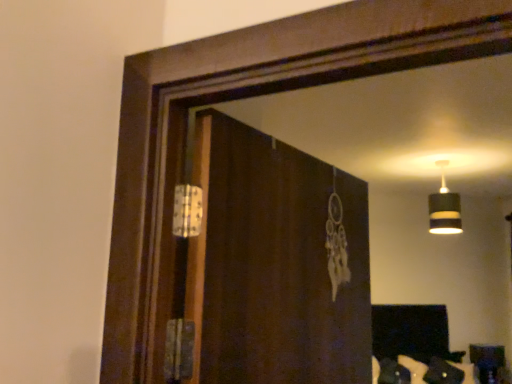
Question: Would you consider black striped lampshade at upper right to be distant from brown wooden screen door at center?

Choices:
 (A) yes
 (B) no

Answer: (A)

Question: Does black striped lampshade at upper right lie behind brown wooden screen door at center?

Choices:
 (A) no
 (B) yes

Answer: (B)

Question: From a real-world perspective, is black striped lampshade at upper right positioned over brown wooden screen door at center based on gravity?

Choices:
 (A) no
 (B) yes

Answer: (B)

Question: From a real-world perspective, is black striped lampshade at upper right under brown wooden screen door at center?

Choices:
 (A) no
 (B) yes

Answer: (A)

Question: Does black striped lampshade at upper right touch brown wooden screen door at center?

Choices:
 (A) no
 (B) yes

Answer: (A)

Question: Is brown wooden screen door at center surrounded by black striped lampshade at upper right?

Choices:
 (A) no
 (B) yes

Answer: (A)

Question: Is wooden table at lower right closer to the viewer compared to brown wooden screen door at center?

Choices:
 (A) no
 (B) yes

Answer: (A)

Question: Does wooden table at lower right have a greater height compared to brown wooden screen door at center?

Choices:
 (A) yes
 (B) no

Answer: (B)

Question: Can you confirm if wooden table at lower right is shorter than brown wooden screen door at center?

Choices:
 (A) no
 (B) yes

Answer: (B)

Question: Is wooden table at lower right looking in the opposite direction of brown wooden screen door at center?

Choices:
 (A) yes
 (B) no

Answer: (B)

Question: From the image's perspective, is wooden table at lower right beneath brown wooden screen door at center?

Choices:
 (A) no
 (B) yes

Answer: (B)

Question: Is wooden table at lower right smaller than brown wooden screen door at center?

Choices:
 (A) yes
 (B) no

Answer: (A)

Question: From the image's perspective, is brown wooden screen door at center under black striped lampshade at upper right?

Choices:
 (A) yes
 (B) no

Answer: (A)